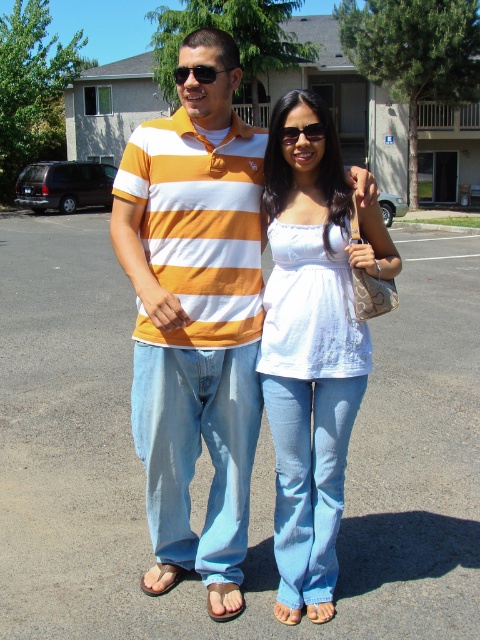
Question: Does light gray asphalt at center lie in front of matte striped polo shirt at center?

Choices:
 (A) yes
 (B) no

Answer: (B)

Question: Is black plastic sunglasses at center positioned behind brown leather sandal at lower center?

Choices:
 (A) yes
 (B) no

Answer: (B)

Question: Considering the relative positions of white cotton tank top at center and black plastic sunglasses at center in the image provided, where is white cotton tank top at center located with respect to black plastic sunglasses at center?

Choices:
 (A) above
 (B) below

Answer: (B)

Question: Among these objects, which one is farthest from the camera?

Choices:
 (A) white cotton tank top at center
 (B) black plastic sunglasses at center

Answer: (B)

Question: Among these objects, which one is farthest from the camera?

Choices:
 (A) orange striped polo shirt at center
 (B) black plastic sunglasses at center
 (C) light gray asphalt at center

Answer: (C)

Question: Which point is closer to the camera?

Choices:
 (A) black plastic sunglasses at center
 (B) brown suede sandal at lower center
 (C) white cotton tank top at center

Answer: (C)